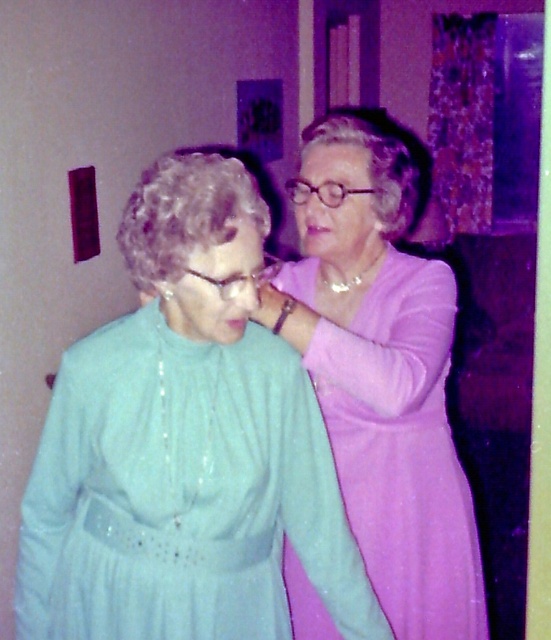
You are a fashion designer standing 1.2 meters away from a model wearing the matte green dress at center. Can you comfortably reach out and adjust the dress without moving closer? Please explain your reasoning.

The matte green dress at center is 1.13 meters from the viewer. Since you are standing 1.2 meters away, you are slightly farther than the dress. However, the distance is close enough that you could likely reach out and make minor adjustments without needing to move closer, depending on your arm length.

You are an interior designer observing the scene. You need to place a small decorative item between the matte purple dress at upper right and the matte pink forehead at upper center. Based on their positions, where should you place the item?

The matte purple dress at upper right is located below the matte pink forehead at upper center, so placing the decorative item between them would require positioning it above the matte purple dress at upper right and below the matte pink forehead at upper center.